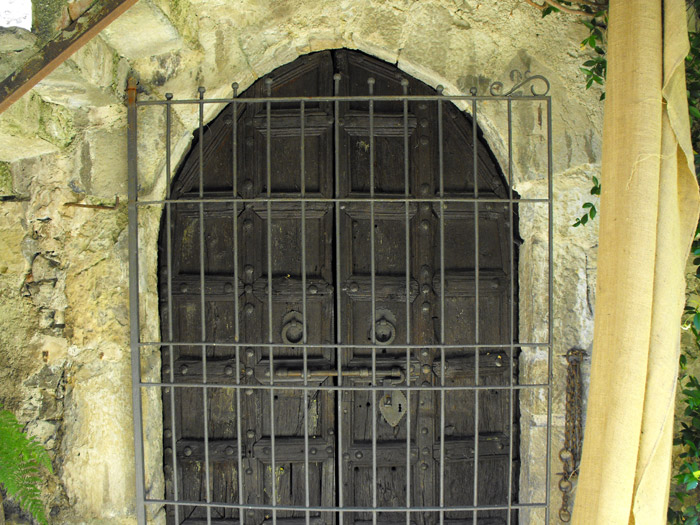
The image size is (700, 525). I want to click on door knocker, so click(x=287, y=320).